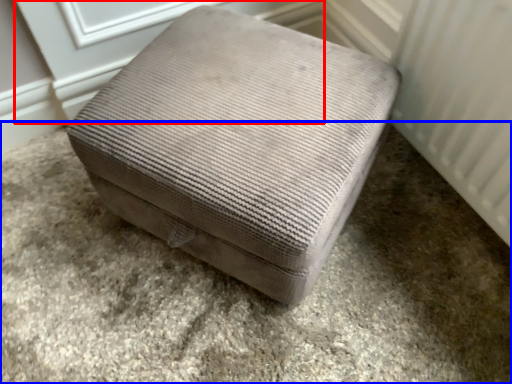
Question: Which point is closer to the camera, screen door (highlighted by a red box) or concrete (highlighted by a blue box)?

Choices:
 (A) screen door
 (B) concrete

Answer: (B)